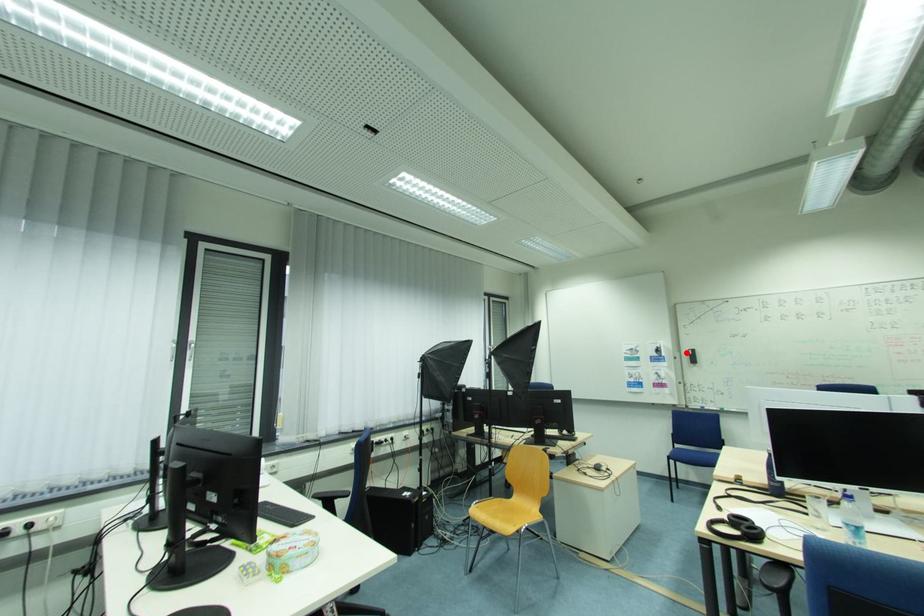
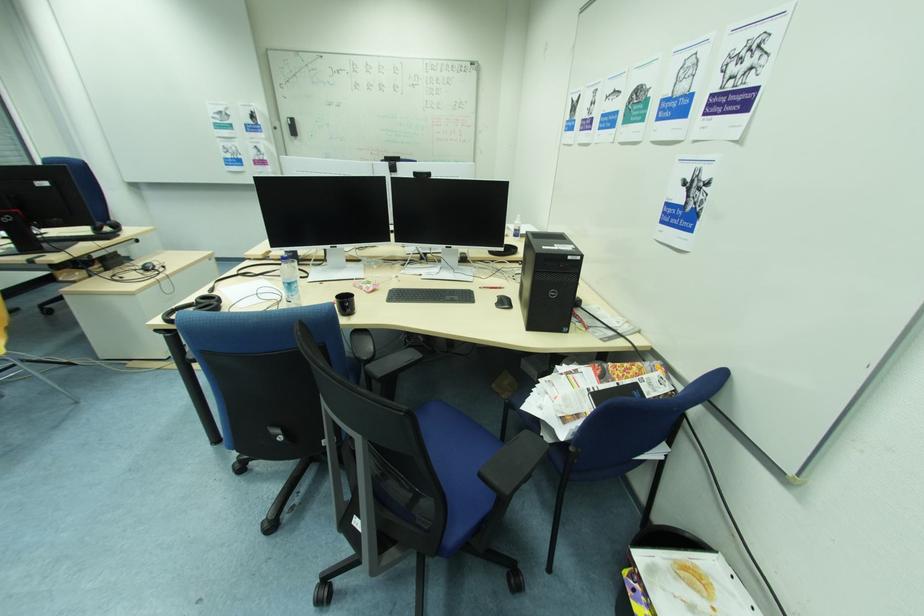
Question: I am providing you with two images of the same scene from different viewpoints. Image1 has a red point marked. In image2, the corresponding 3D location appears at what relative position? Reply with the corresponding letter.

Choices:
 (A) Closer
 (B) Farther

Answer: (A)